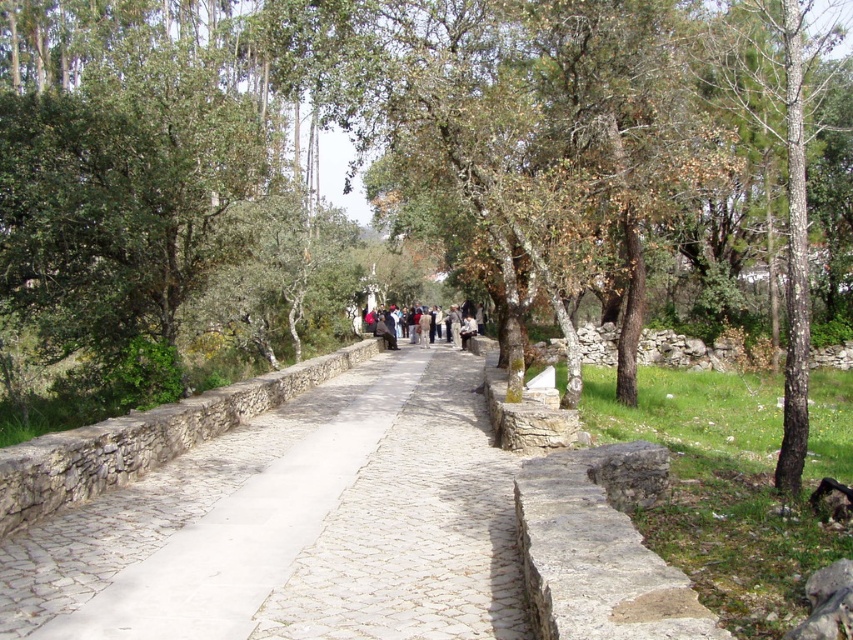
Question: Is white stone path at center bigger than dark gray fabric jacket at center?

Choices:
 (A) yes
 (B) no

Answer: (B)

Question: Which object appears farthest from the camera in this image?

Choices:
 (A) white stone path at center
 (B) dark gray fabric jacket at center

Answer: (B)

Question: Which point is closer to the camera?

Choices:
 (A) dark gray fabric jacket at center
 (B) white stone path at center

Answer: (B)

Question: Does white stone path at center have a lesser width compared to dark gray fabric jacket at center?

Choices:
 (A) yes
 (B) no

Answer: (B)

Question: Does white stone path at center appear on the left side of dark gray fabric jacket at center?

Choices:
 (A) no
 (B) yes

Answer: (B)